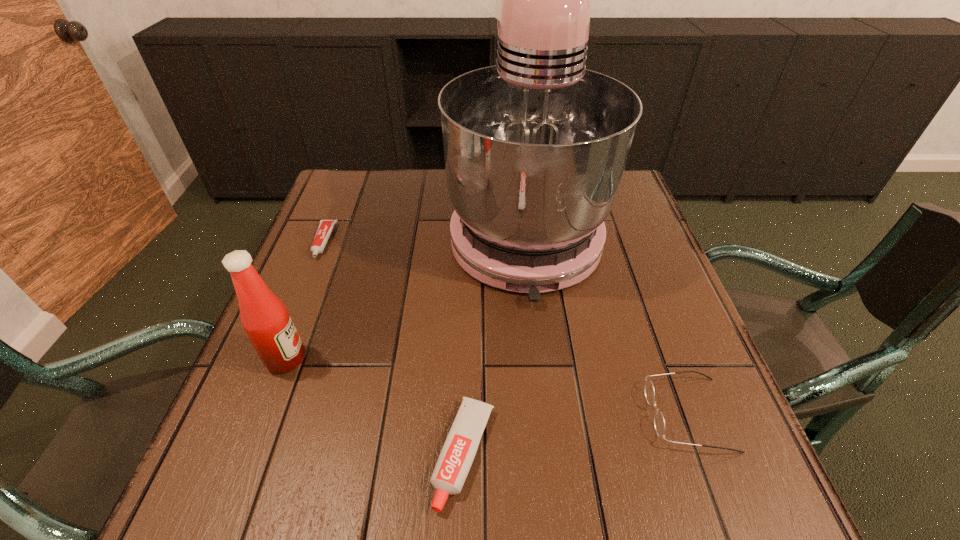
Locate an element on the screen. This screenshot has height=540, width=960. empty space that is in between the nearer toothpaste and the mixer is located at coordinates (494, 341).

Where is `free space between the spectacles and the third nearest object`? free space between the spectacles and the third nearest object is located at coordinates (487, 387).

Locate an element on the screen. vacant space that's between the left toothpaste and the taller toothpaste is located at coordinates (394, 348).

Image resolution: width=960 pixels, height=540 pixels. In order to click on vacant area that lies between the farther toothpaste and the taller toothpaste in this screenshot , I will do `click(394, 348)`.

Identify the location of vacant space that's between the spectacles and the condiment. (487, 387).

The image size is (960, 540). What are the coordinates of `empty space that is in between the shortest object and the spectacles` in the screenshot? It's located at (506, 328).

Where is `unoccupied area between the spectacles and the nearer toothpaste`? Image resolution: width=960 pixels, height=540 pixels. unoccupied area between the spectacles and the nearer toothpaste is located at coordinates (576, 434).

Locate an element on the screen. Image resolution: width=960 pixels, height=540 pixels. vacant space that's between the shorter toothpaste and the third nearest object is located at coordinates (304, 300).

This screenshot has height=540, width=960. I want to click on the fourth closest object to the condiment, so 659,423.

This screenshot has width=960, height=540. Find the location of `object that is the nearest to the taller toothpaste`. object that is the nearest to the taller toothpaste is located at coordinates (535, 147).